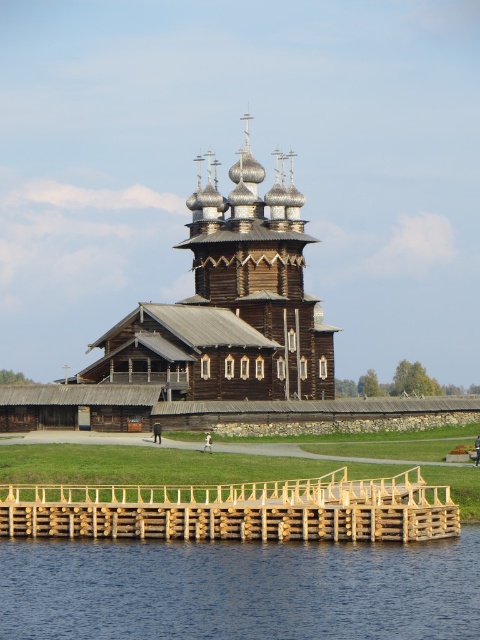
In the scene shown: You are standing on the wooden walkway leading to the church and want to cross to the island. Based on the image, is the transparent water at lower center at point (240,589) passable for walking?

The point (240,589) marks transparent water at lower center, which is likely shallow and calm, so it may be passable for walking depending on depth and stability. However, the image does not provide explicit details about the water depth or the presence of a safe path there.